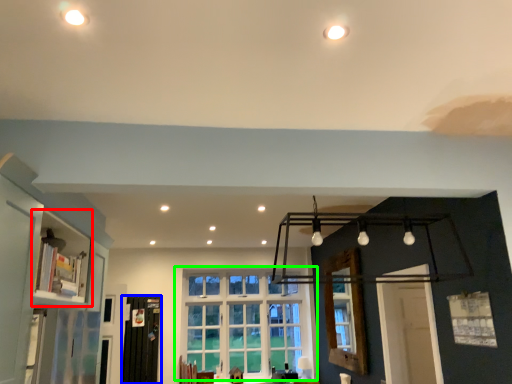
Question: Which object is positioned closest to shelf (highlighted by a red box)? Select from screen door (highlighted by a blue box) and window (highlighted by a green box).

Choices:
 (A) screen door
 (B) window

Answer: (A)